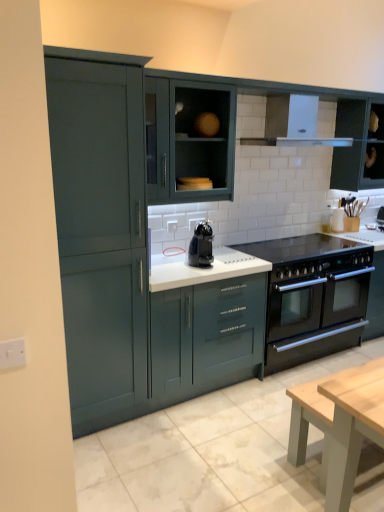
Identify the location of vacant region under black glossy coffee machine at center (from a real-world perspective). This screenshot has height=512, width=384. (211, 263).